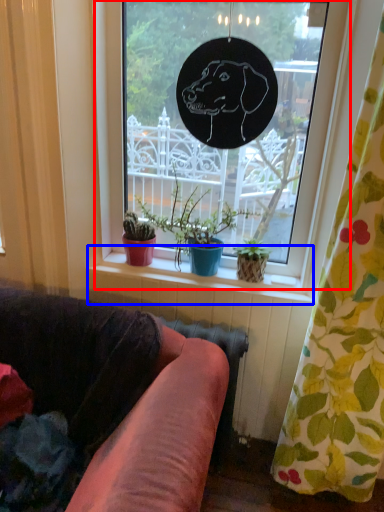
Question: Which point is further to the camera, window (highlighted by a red box) or window sill (highlighted by a blue box)?

Choices:
 (A) window
 (B) window sill

Answer: (B)